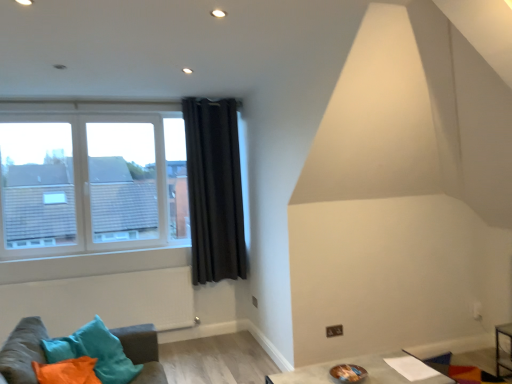
Find the location of a particular element. vacant point above clear glass window at left (from a real-world perspective) is located at coordinates (86, 108).